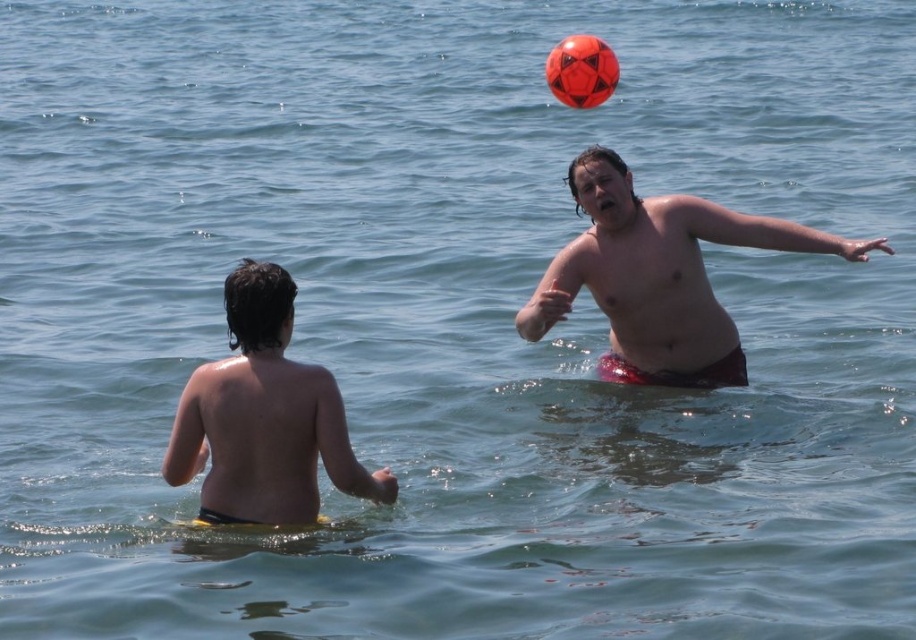
Question: Estimate the real-world distances between objects in this image. Which object is farther from the smooth skin child at center?

Choices:
 (A) smooth red shorts at right
 (B) rubber ball at upper center

Answer: (B)

Question: Is smooth red shorts at right positioned in front of smooth skin child at center?

Choices:
 (A) no
 (B) yes

Answer: (A)

Question: Is smooth red shorts at right thinner than smooth skin child at center?

Choices:
 (A) yes
 (B) no

Answer: (A)

Question: Considering the real-world distances, which object is farthest from the smooth red shorts at right?

Choices:
 (A) rubber ball at upper center
 (B) smooth skin child at center

Answer: (A)

Question: Does smooth red shorts at right have a larger size compared to rubber ball at upper center?

Choices:
 (A) yes
 (B) no

Answer: (B)

Question: Which object appears closest to the camera in this image?

Choices:
 (A) rubber ball at upper center
 (B) smooth skin child at center

Answer: (B)